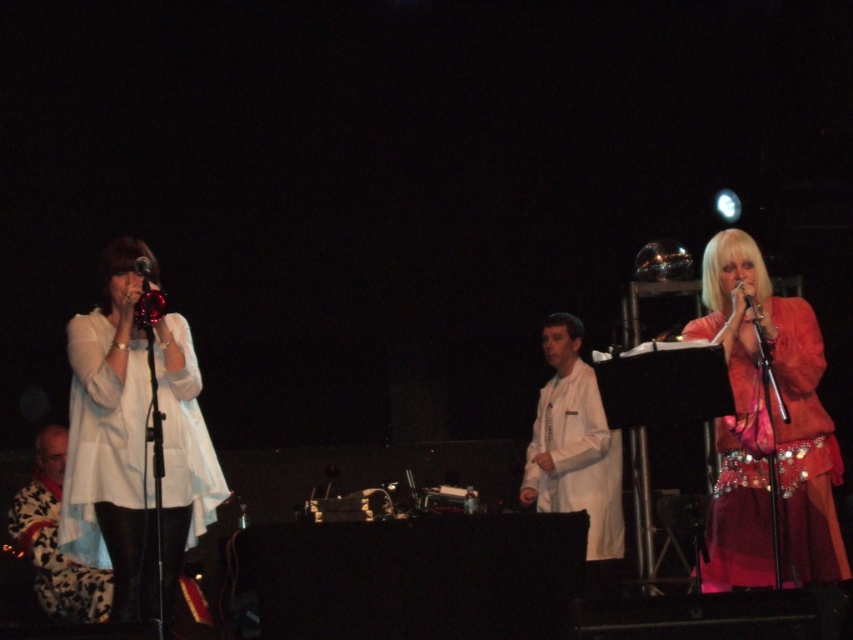
You are a photographer positioned at the camera. You want to capture a closeup shot of the white matte dress at left. Given that your camera has a minimum focusing distance of 2 meters, can you successfully take the photo without moving the dress?

The white matte dress at left is 3.76 meters away from the camera, which is beyond the minimum focusing distance of 2 meters. Therefore, you can successfully take the closeup shot without moving the dress.

You are a photographer at the event and want to capture a photo that includes both the person holding the microphone and the shiny red dress at right. Based on their positions, where should you position yourself to include both in the frame?

To include both the person holding the microphone and the shiny red dress at right in the frame, position yourself at a point that allows you to capture the entire width of the scene, as the shiny red dress at right is located at the lower right corner of the image.